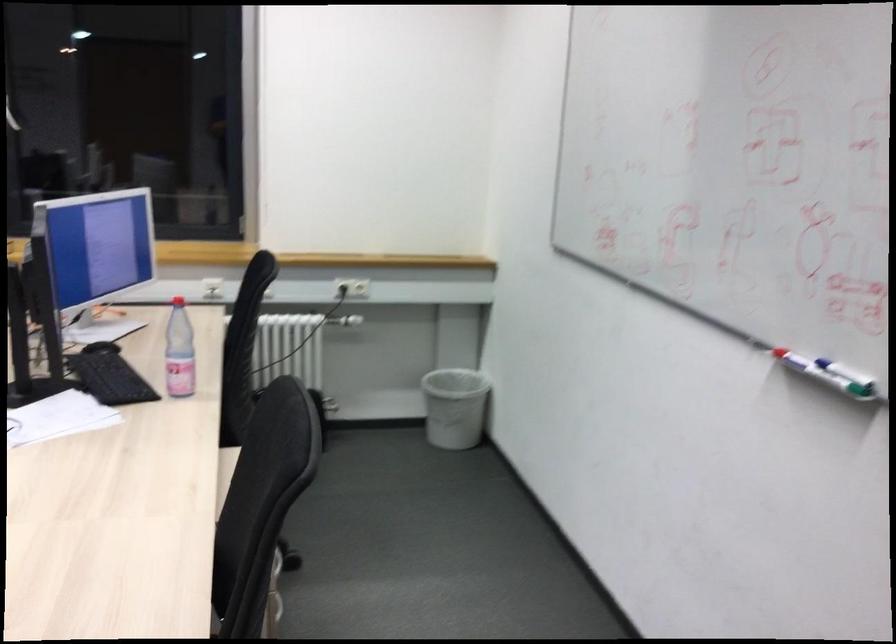
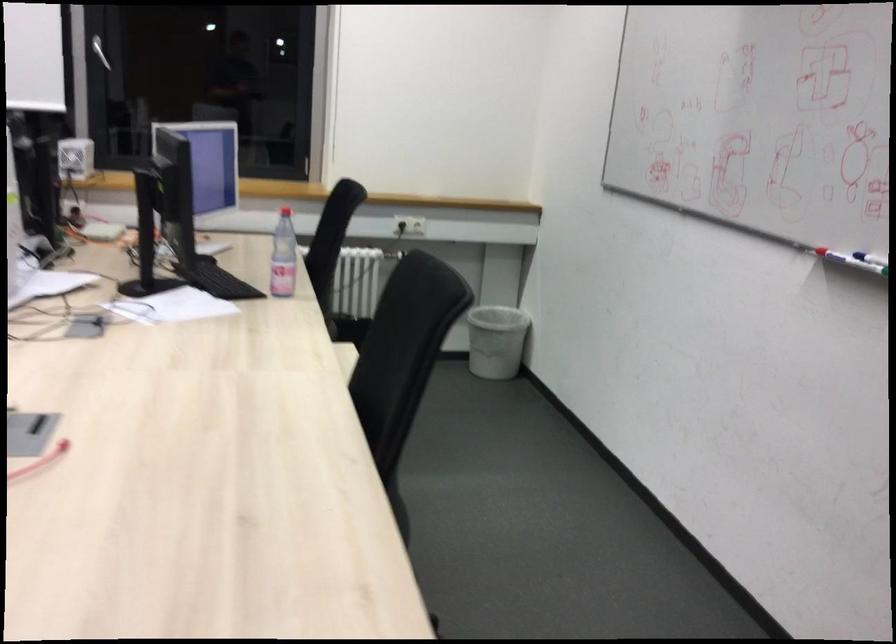
Question: The images are taken continuously from a first-person perspective. In which direction is your viewpoint rotating?

Choices:
 (A) Left
 (B) Right
 (C) Up
 (D) Down

Answer: (D)